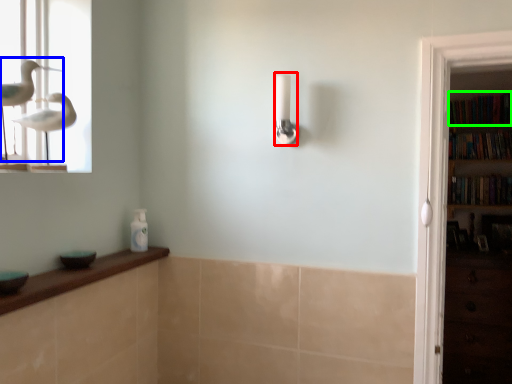
Question: Which is nearer to the shower (highlighted by a red box)? bird (highlighted by a blue box) or book (highlighted by a green box).

Choices:
 (A) bird
 (B) book

Answer: (A)